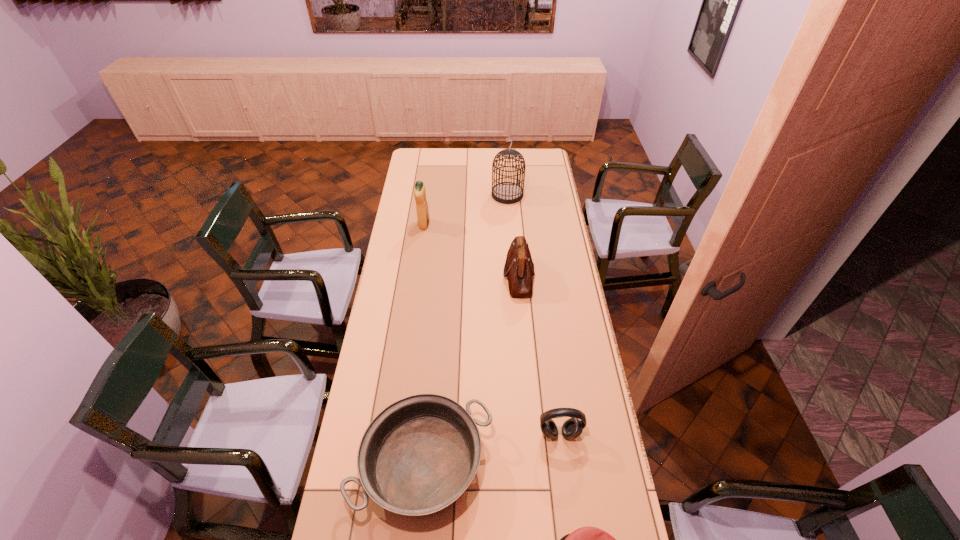
The height and width of the screenshot is (540, 960). What are the coordinates of `free space that satisfies the following two spatial constraints: 1. on the back side of the fourth shortest object; 2. on the label of the detergent` in the screenshot? It's located at [515, 225].

The width and height of the screenshot is (960, 540). In order to click on vacant region that satisfies the following two spatial constraints: 1. on the label of the shoulder bag; 2. on the right side of the fifth shortest object in this screenshot , I will do `click(417, 276)`.

The height and width of the screenshot is (540, 960). Identify the location of vacant space that satisfies the following two spatial constraints: 1. on the label of the detergent; 2. on the back side of the pan. (391, 464).